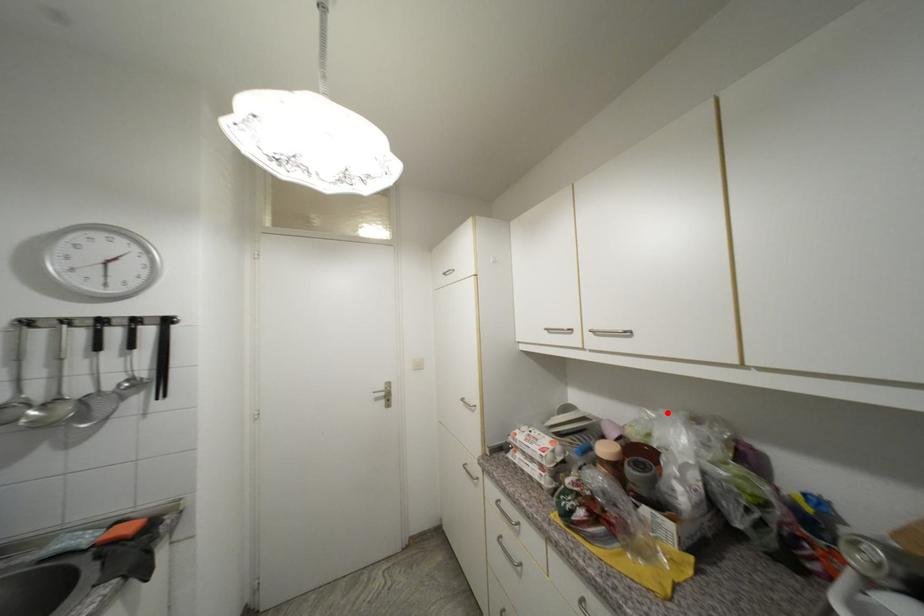
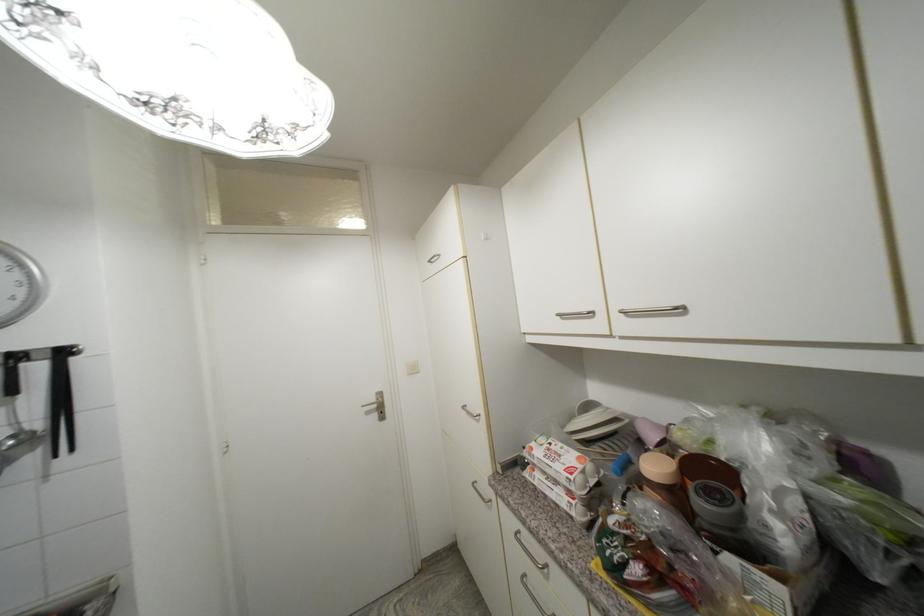
The point at the highlighted location is marked in the first image. Where is the corresponding point in the second image?

(730, 410)